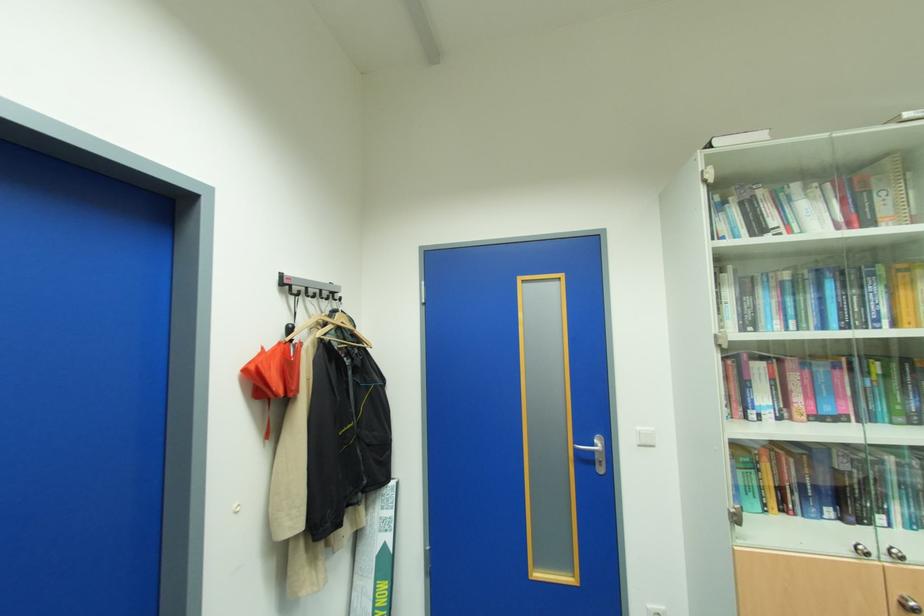
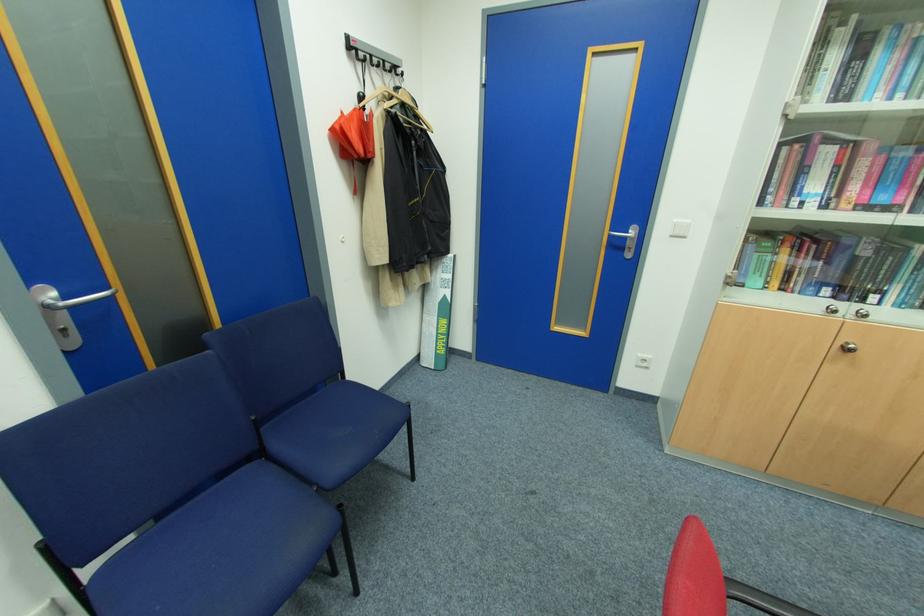
Locate, in the second image, the point that corresponds to (256,368) in the first image.

(341, 127)